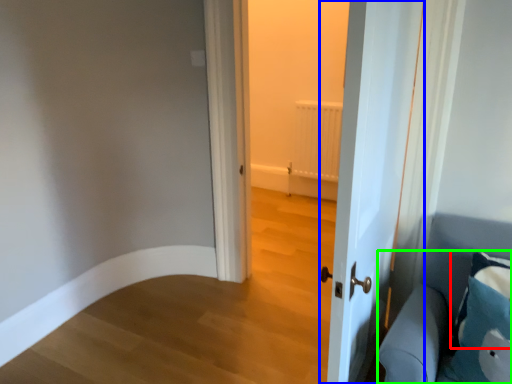
Question: Which is nearer to the pillow (highlighted by a red box)? door (highlighted by a blue box) or furniture (highlighted by a green box).

Choices:
 (A) door
 (B) furniture

Answer: (B)